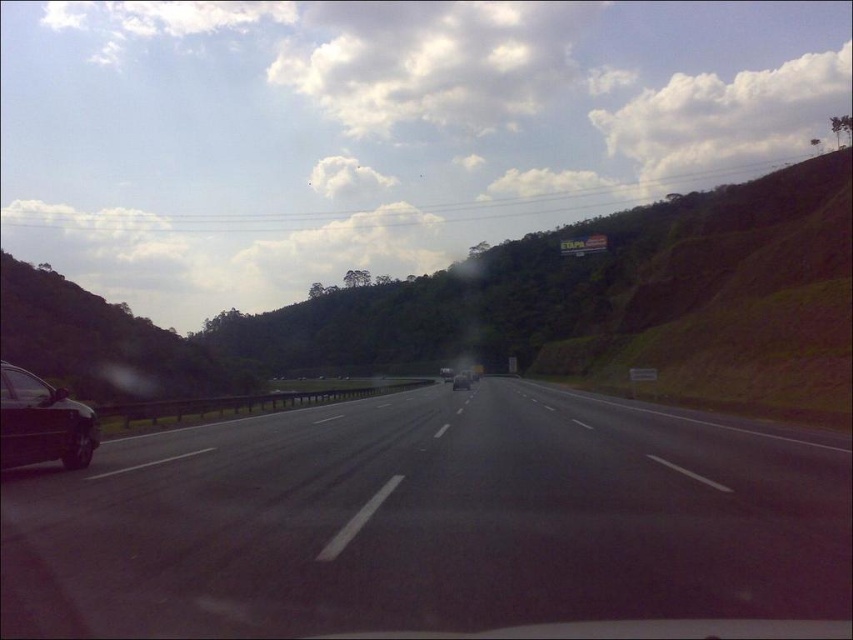
Question: Which point is farther to the camera?

Choices:
 (A) (471, 378)
 (B) (216, 435)
 (C) (9, 432)

Answer: (A)

Question: Is metallic silver car at center positioned behind metallic silver sedan at center?

Choices:
 (A) no
 (B) yes

Answer: (A)

Question: Which point appears closest to the camera in this image?

Choices:
 (A) (447, 378)
 (B) (466, 385)
 (C) (763, 548)
 (D) (38, 438)

Answer: (C)

Question: Does shiny black sedan at left come behind metallic silver car at center?

Choices:
 (A) yes
 (B) no

Answer: (B)

Question: Which of the following is the closest to the observer?

Choices:
 (A) (463, 385)
 (B) (476, 426)
 (C) (84, 412)

Answer: (C)

Question: Does shiny black sedan at left appear over metallic silver car at center?

Choices:
 (A) yes
 (B) no

Answer: (A)